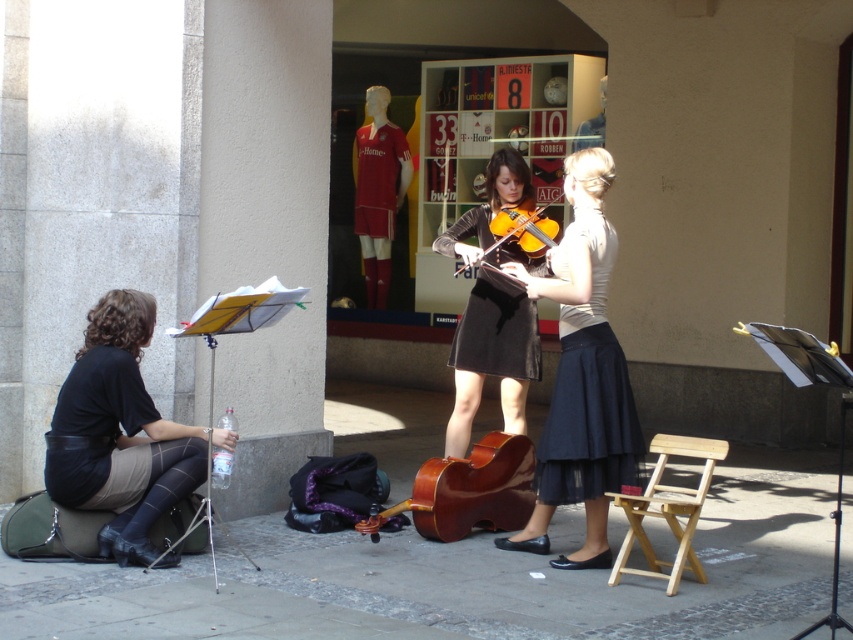
Is point (486, 257) less distant than point (599, 81)?

Yes, point (486, 257) is in front of point (599, 81).

Which of these two, wooden violin at center or smooth leather jacket at upper center, stands shorter?

Standing shorter between the two is wooden violin at center.

Between point (550, 243) and point (584, 138), which one is positioned behind?

Positioned behind is point (584, 138).

You are a GUI agent. You are given a task and a screenshot of the screen. Output one action in this format:
    pyautogui.click(x=<x>, y=<y>)
    Task: Click on the wooden violin at center
    
    Given the screenshot: What is the action you would take?
    pyautogui.click(x=523, y=228)

Is point (62, 413) positioned after point (517, 195)?

No, (62, 413) is closer to viewer.

Who is higher up, black leather skirt at lower left or velvet black skirt at center?

velvet black skirt at center is above.

Is point (78, 413) positioned behind point (502, 280)?

No, (78, 413) is closer to viewer.

This screenshot has width=853, height=640. I want to click on black leather skirt at lower left, so click(x=120, y=435).

Who is positioned more to the right, light wood folding chair at lower right or wooden violin at center?

light wood folding chair at lower right

Does light wood folding chair at lower right have a larger size compared to wooden violin at center?

Correct, light wood folding chair at lower right is larger in size than wooden violin at center.

Measure the distance between point (688, 552) and camera.

Point (688, 552) is 6.82 meters away from camera.

In order to click on light wood folding chair at lower right in this screenshot , I will do `click(666, 509)`.